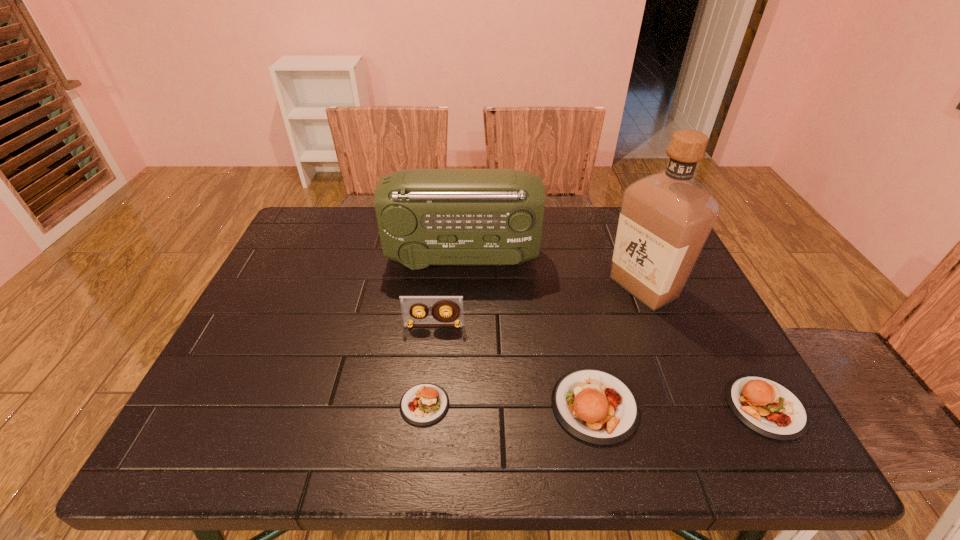
Where is `patty (food) identified as the third closest to the second tallest object`? patty (food) identified as the third closest to the second tallest object is located at coordinates (767, 407).

Identify which patty (food) is the second closest to the second shortest patty (food). Please provide its 2D coordinates. Your answer should be formatted as a tuple, i.e. [(x, y)], where the tuple contains the x and y coordinates of a point satisfying the conditions above.

[(424, 404)]

Locate an element on the screen. The image size is (960, 540). blank area in the image that satisfies the following two spatial constraints: 1. on the front-facing side of the tallest object; 2. at the front of the fourth shortest object with visible reels is located at coordinates (660, 326).

Identify the location of free space that satisfies the following two spatial constraints: 1. on the front-facing side of the radio_receiver; 2. on the left side of the second patty (food) from right to left. The width and height of the screenshot is (960, 540). (454, 406).

Find the location of a particular element. The height and width of the screenshot is (540, 960). vacant space that satisfies the following two spatial constraints: 1. on the front side of the second patty (food) from left to right; 2. on the right side of the second shortest patty (food) is located at coordinates (595, 407).

Locate an element on the screen. The width and height of the screenshot is (960, 540). vacant space that satisfies the following two spatial constraints: 1. on the front side of the second shortest patty (food); 2. on the left side of the second patty (food) from right to left is located at coordinates (595, 407).

Identify the location of vacant space that satisfies the following two spatial constraints: 1. at the front of the videotape with visible reels; 2. on the right side of the rightmost patty (food). Image resolution: width=960 pixels, height=540 pixels. (425, 407).

The height and width of the screenshot is (540, 960). I want to click on vacant space that satisfies the following two spatial constraints: 1. on the front-facing side of the fifth shortest object; 2. on the front side of the shortest object, so click(454, 404).